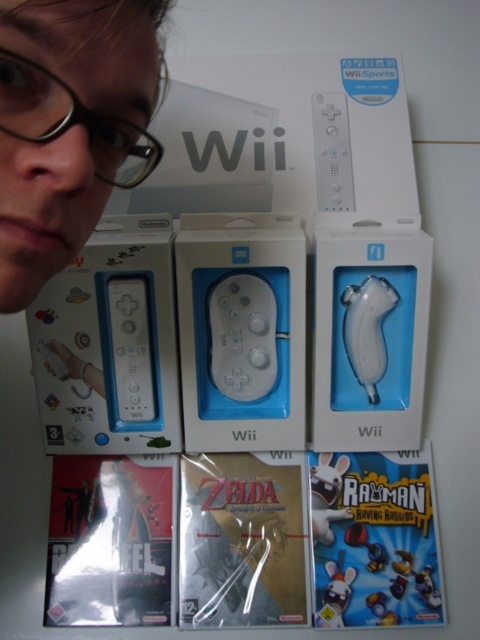
You are trying to decide which item to place in a smaller storage container. Based on the scene, which item between the clear plastic glasses at upper left and the white matte game controller at center would you choose to fit better?

The white matte game controller at center is smaller than the clear plastic glasses at upper left, so it would fit better in a smaller storage container.

You are organizing a Nintendo Wii accessory display. You have a white matte remote at upper center and a matte white mouse at lower center. Which accessory is positioned higher on the display surface?

The white matte remote at upper center is positioned higher on the display surface than the matte white mouse at lower center.